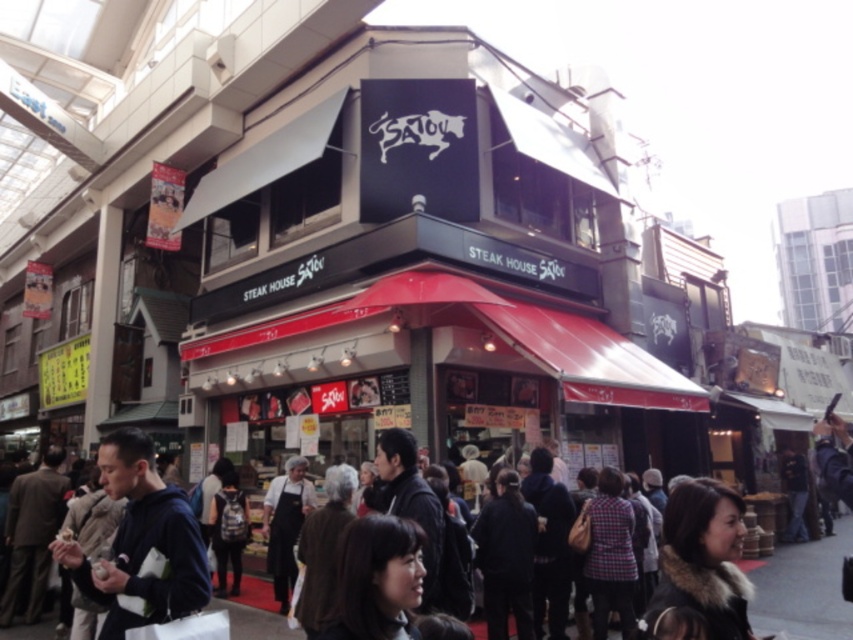
Does dark blue hoodie at lower left have a lesser width compared to dark brown leather jacket at center?

Correct, dark blue hoodie at lower left's width is less than dark brown leather jacket at center's.

Is point (123, 620) more distant than point (788, 608)?

No, (123, 620) is in front of (788, 608).

At what (x,y) coordinates should I click in order to perform the action: click on dark blue hoodie at lower left. Please return your answer as a coordinate pair (x, y). This screenshot has height=640, width=853. Looking at the image, I should click on (140, 544).

Does dark brown fur-trimmed coat at center have a greater height compared to dark brown leather jacket at center?

No.

Is point (734, 609) behind point (828, 604)?

No.

At what (x,y) coordinates should I click in order to perform the action: click on dark brown fur-trimmed coat at center. Please return your answer as a coordinate pair (x, y). Image resolution: width=853 pixels, height=640 pixels. Looking at the image, I should click on (704, 557).

Image resolution: width=853 pixels, height=640 pixels. What are the coordinates of `dark blue hoodie at lower left` in the screenshot? It's located at (140, 544).

Who is more forward, (x=109, y=570) or (x=698, y=556)?

Point (x=698, y=556) is in front.

Is point (103, 588) in front of point (663, 580)?

No.

Locate an element on the screen. This screenshot has height=640, width=853. dark blue hoodie at lower left is located at coordinates tap(140, 544).